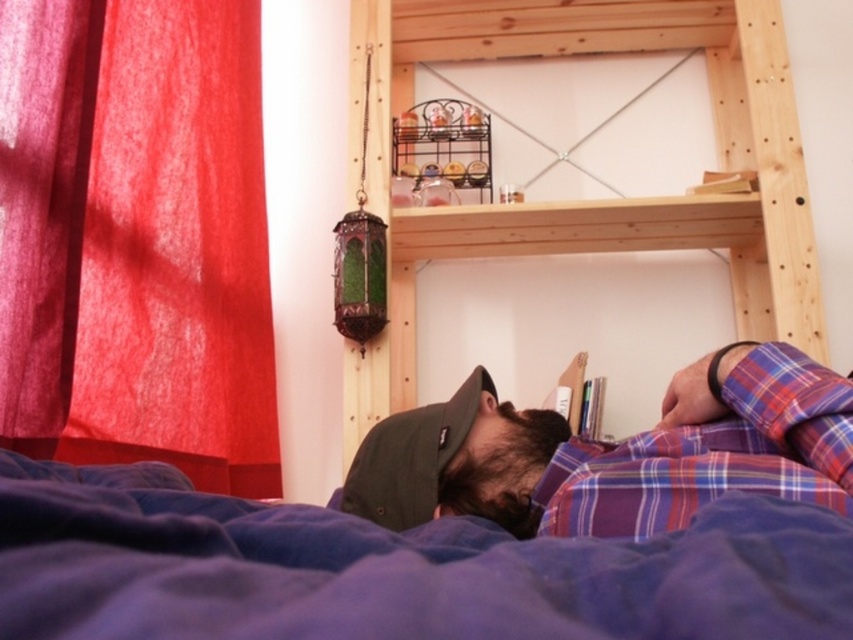
Question: Among these objects, which one is nearest to the camera?

Choices:
 (A) red fabric curtain at left
 (B) wooden bunk bed at upper center
 (C) blue soft blanket at lower center
 (D) green fabric cap at center

Answer: (C)

Question: Can you confirm if wooden bunk bed at upper center is wider than green fabric cap at center?

Choices:
 (A) yes
 (B) no

Answer: (A)

Question: Estimate the real-world distances between objects in this image. Which object is farther from the blue soft blanket at lower center?

Choices:
 (A) plaid fabric shirt at lower center
 (B) green fabric cap at center

Answer: (B)

Question: Can you confirm if blue soft blanket at lower center is positioned above green fabric cap at center?

Choices:
 (A) yes
 (B) no

Answer: (A)

Question: Is red fabric curtain at left smaller than green fabric cap at center?

Choices:
 (A) no
 (B) yes

Answer: (A)

Question: Which of the following is the farthest from the observer?

Choices:
 (A) green fabric cap at center
 (B) blue soft blanket at lower center
 (C) plaid fabric shirt at lower center
 (D) red fabric curtain at left

Answer: (D)